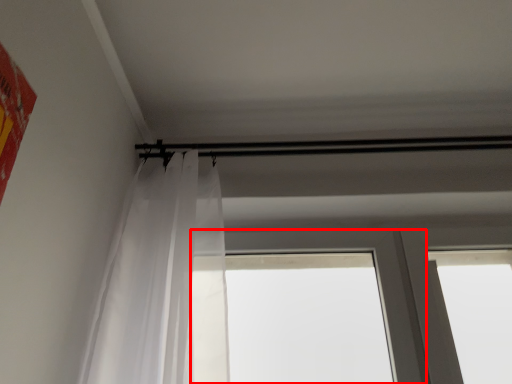
Question: Where is window (annotated by the red box) located in relation to curtain in the image?

Choices:
 (A) right
 (B) left

Answer: (A)